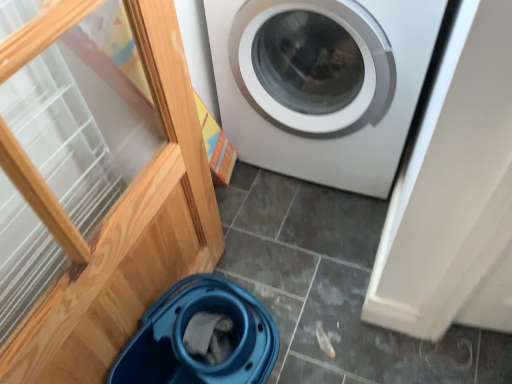
Question: Should I look upward or downward to see white glossy washing machine at center?

Choices:
 (A) down
 (B) up

Answer: (B)

Question: From a real-world perspective, is white glossy washing machine at center on top of blue plastic bucket at lower left?

Choices:
 (A) no
 (B) yes

Answer: (B)

Question: Does white glossy washing machine at center have a lesser width compared to blue plastic bucket at lower left?

Choices:
 (A) yes
 (B) no

Answer: (B)

Question: Is white glossy washing machine at center smaller than blue plastic bucket at lower left?

Choices:
 (A) yes
 (B) no

Answer: (B)

Question: Is white glossy washing machine at center touching blue plastic bucket at lower left?

Choices:
 (A) no
 (B) yes

Answer: (A)

Question: Considering the relative sizes of white glossy washing machine at center and blue plastic bucket at lower left in the image provided, is white glossy washing machine at center wider than blue plastic bucket at lower left?

Choices:
 (A) yes
 (B) no

Answer: (A)

Question: Is there a large distance between white glossy washing machine at center and blue plastic bucket at lower left?

Choices:
 (A) yes
 (B) no

Answer: (B)

Question: Considering the relative sizes of blue plastic bucket at lower left and white glossy washing machine at center in the image provided, is blue plastic bucket at lower left smaller than white glossy washing machine at center?

Choices:
 (A) yes
 (B) no

Answer: (A)

Question: Is the position of blue plastic bucket at lower left less distant than that of white glossy washing machine at center?

Choices:
 (A) no
 (B) yes

Answer: (B)

Question: Is blue plastic bucket at lower left taller than white glossy washing machine at center?

Choices:
 (A) no
 (B) yes

Answer: (A)

Question: Is blue plastic bucket at lower left thinner than white glossy washing machine at center?

Choices:
 (A) yes
 (B) no

Answer: (A)

Question: From the image's perspective, is blue plastic bucket at lower left beneath white glossy washing machine at center?

Choices:
 (A) no
 (B) yes

Answer: (B)

Question: Is blue plastic bucket at lower left not near white glossy washing machine at center?

Choices:
 (A) no
 (B) yes

Answer: (A)

Question: From the image's perspective, relative to blue plastic bucket at lower left, is white glossy washing machine at center above or below?

Choices:
 (A) below
 (B) above

Answer: (B)